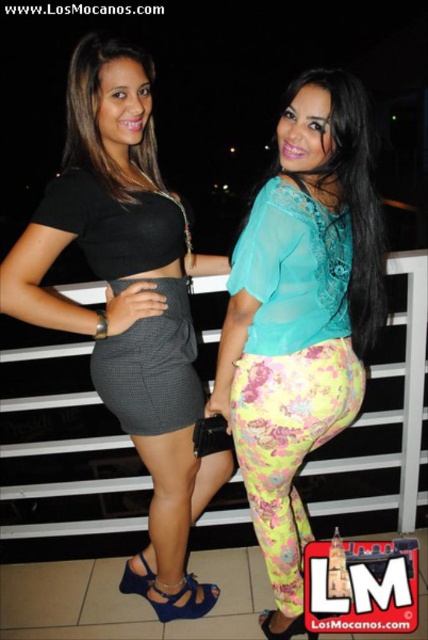
Does matte black top at center appear over translucent teal blouse at upper center?

No, matte black top at center is not above translucent teal blouse at upper center.

Who is lower down, matte black top at center or translucent teal blouse at upper center?

Positioned lower is matte black top at center.

Between point (67, 172) and point (353, 301), which one is positioned in front?

Point (67, 172) is in front.

Where is `matte black top at center`? matte black top at center is located at coordinates (128, 304).

You are a GUI agent. You are given a task and a screenshot of the screen. Output one action in this format:
    pyautogui.click(x=<x>, y=<y>)
    Task: Click on the translucent teal blouse at upper center
    The image size is (428, 640).
    Given the screenshot: What is the action you would take?
    tap(353, 195)

Consider the image. Between translucent teal blouse at upper center and matte black top at upper left, which one is positioned higher?

Positioned higher is matte black top at upper left.

You are a GUI agent. You are given a task and a screenshot of the screen. Output one action in this format:
    pyautogui.click(x=<x>, y=<y>)
    Task: Click on the translucent teal blouse at upper center
    Image resolution: width=428 pixels, height=640 pixels.
    Given the screenshot: What is the action you would take?
    pyautogui.click(x=353, y=195)

Does floral chiffon pants at center come in front of translucent teal blouse at upper center?

That is False.

Does point (273, 525) lie in front of point (297, 88)?

That is False.

Who is more distant from viewer, (276,324) or (357,141)?

The point (276,324) is behind.

The width and height of the screenshot is (428, 640). What are the coordinates of `floral chiffon pants at center` in the screenshot? It's located at (300, 316).